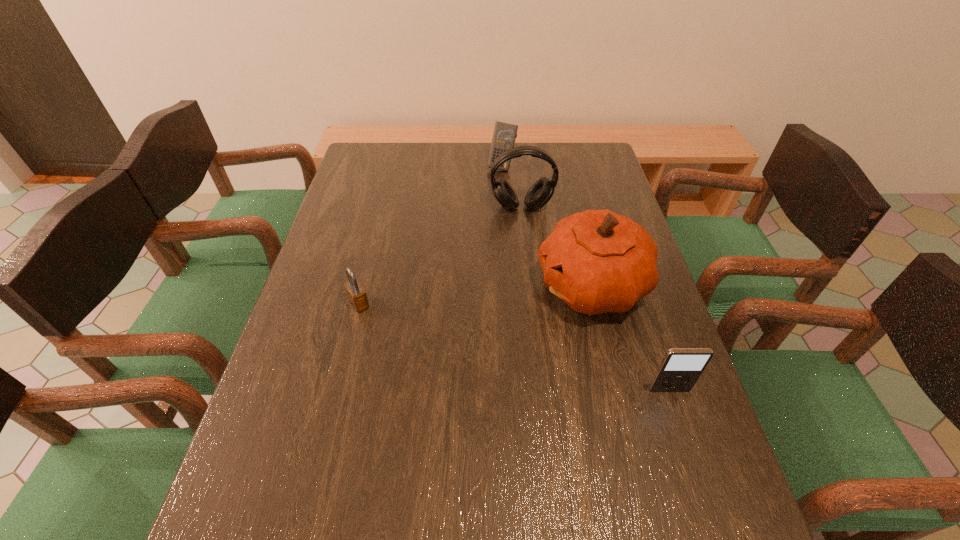
You are a GUI agent. You are given a task and a screenshot of the screen. Output one action in this format:
    pyautogui.click(x=<x>, y=<y>)
    Task: Click on the vacant spot on the desktop that is between the padlock and the nearest object and is positioned on the front-facing side of the pumpkin
    
    Given the screenshot: What is the action you would take?
    [x=458, y=331]

The width and height of the screenshot is (960, 540). I want to click on free space on the desktop that is between the leftmost object and the iPod and is positioned on the front-facing side of the calculator, so pyautogui.click(x=460, y=332).

Find the location of a particular element. This screenshot has height=540, width=960. free space on the desktop that is between the shortest object and the nearest object and is positioned on the earcups of the second farthest object is located at coordinates (542, 354).